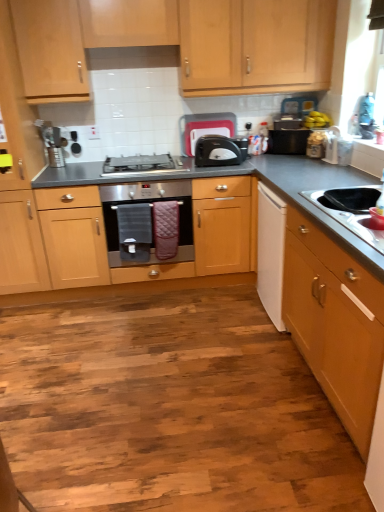
Question: Is point (57, 150) positioned closer to the camera than point (357, 229)?

Choices:
 (A) farther
 (B) closer

Answer: (A)

Question: Considering their positions, is brushed metal toaster at center, which appears as the fourth appliance when viewed from the right, located in front of or behind stainless steel sink at lower right?

Choices:
 (A) front
 (B) behind

Answer: (B)

Question: Based on their relative distances, which object is farther from the stainless steel oven at center?

Choices:
 (A) black plastic microwave at upper right, acting as the 4th appliance starting from the left
 (B) satin silver gas stove at center
 (C) black plastic toaster at center, positioned as the 2th appliance in right-to-left order
 (D) light wood cabinet at upper center, which is the second cabinetry in front-to-back order
 (E) white matte drawer at right

Answer: (E)

Question: Based on their relative distances, which object is farther from the satin silver gas stove at center?

Choices:
 (A) light wood cabinet at upper center, which ranks as the first cabinetry in back-to-front order
 (B) black matte countertop at center
 (C) white matte drawer at right
 (D) satin black toaster at center
 (E) stainless steel oven at center

Answer: (C)